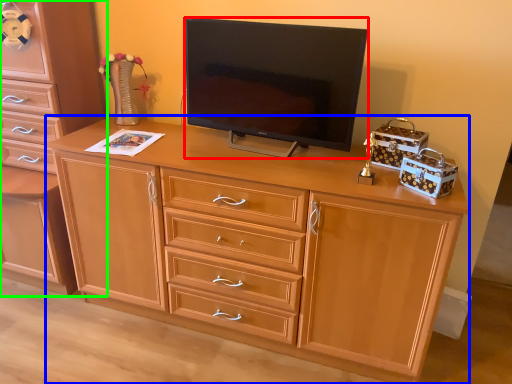
Question: Which object is the farthest from television (highlighted by a red box)? Choose among these: desk (highlighted by a blue box) or chest of drawers (highlighted by a green box).

Choices:
 (A) desk
 (B) chest of drawers

Answer: (B)